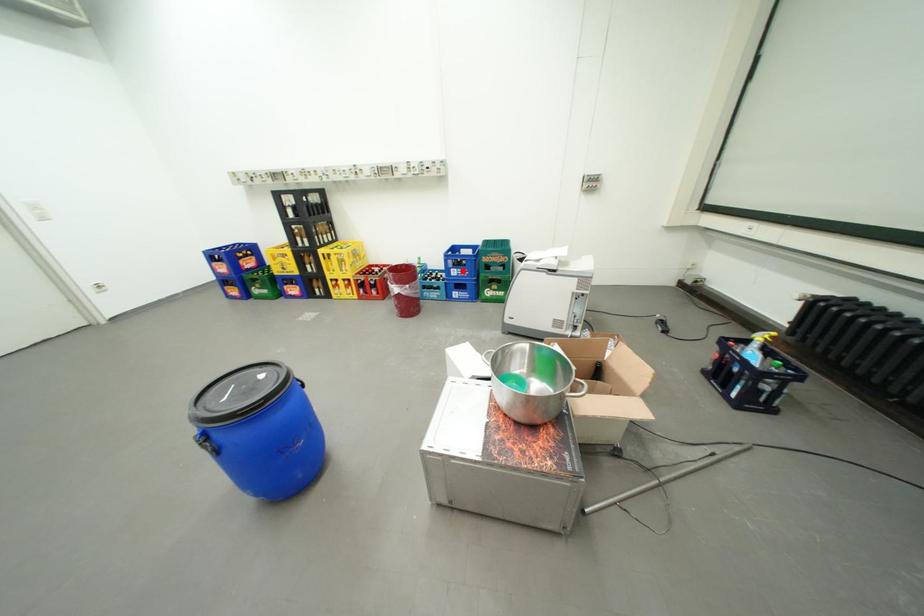
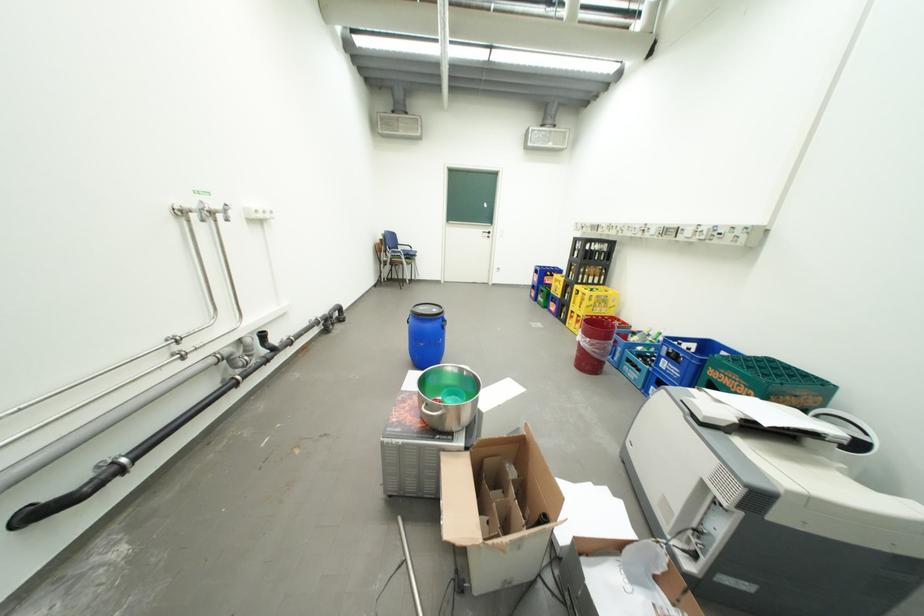
Find the pixel in the second image that matches the highlighted location in the first image.

(674, 361)